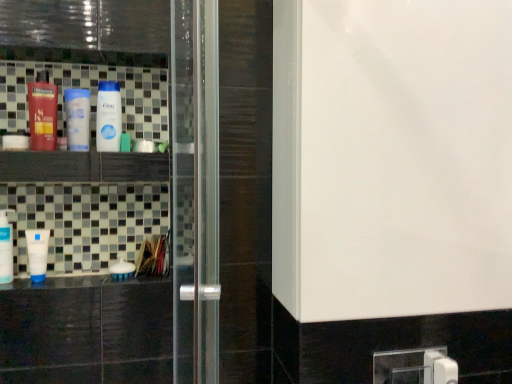
Question: Would you say white matte bottle at center, positioned as the 6th bottle in left-to-right order, contains matte black bottle at left, which is the fourth bottle from right to left?

Choices:
 (A) no
 (B) yes

Answer: (A)

Question: Is white matte bottle at center, positioned as the 6th bottle in left-to-right order, located outside matte black bottle at left, which is the fourth bottle from right to left?

Choices:
 (A) no
 (B) yes

Answer: (B)

Question: Is white matte bottle at center, positioned as the 6th bottle in left-to-right order, at the right side of matte black bottle at left, which is the fourth bottle from right to left?

Choices:
 (A) yes
 (B) no

Answer: (A)

Question: Is white matte bottle at center, positioned as the 1th bottle in right-to-left order, further to the viewer compared to matte black bottle at left, which is the fourth bottle from right to left?

Choices:
 (A) no
 (B) yes

Answer: (B)

Question: Is white matte bottle at center, positioned as the 6th bottle in left-to-right order, touching matte black bottle at left, positioned as the third bottle in left-to-right order?

Choices:
 (A) no
 (B) yes

Answer: (A)

Question: Is white matte bottle at center, positioned as the 6th bottle in left-to-right order, to the left of matte black bottle at left, positioned as the third bottle in left-to-right order, from the viewer's perspective?

Choices:
 (A) yes
 (B) no

Answer: (B)

Question: From a real-world perspective, is white glossy tube at left, which is the first bottle in left-to-right order, positioned over matte black bottle at left, which is the fourth bottle from right to left, based on gravity?

Choices:
 (A) yes
 (B) no

Answer: (B)

Question: Can you confirm if white glossy tube at left, arranged as the sixth bottle when viewed from the right, is bigger than matte black bottle at left, positioned as the third bottle in left-to-right order?

Choices:
 (A) yes
 (B) no

Answer: (B)

Question: Is white glossy tube at left, which is the first bottle in left-to-right order, behind matte black bottle at left, positioned as the third bottle in left-to-right order?

Choices:
 (A) yes
 (B) no

Answer: (A)

Question: Does white glossy tube at left, which is the first bottle in left-to-right order, have a smaller size compared to matte black bottle at left, which is the fourth bottle from right to left?

Choices:
 (A) no
 (B) yes

Answer: (B)

Question: Does white glossy tube at left, which is the first bottle in left-to-right order, appear on the left side of matte black bottle at left, which is the fourth bottle from right to left?

Choices:
 (A) no
 (B) yes

Answer: (B)

Question: Is white glossy tube at left, arranged as the sixth bottle when viewed from the right, not near matte black bottle at left, which is the fourth bottle from right to left?

Choices:
 (A) no
 (B) yes

Answer: (A)

Question: Is transparent glass screen door at center to the left of white matte bottle at center, positioned as the 1th bottle in right-to-left order, from the viewer's perspective?

Choices:
 (A) yes
 (B) no

Answer: (B)